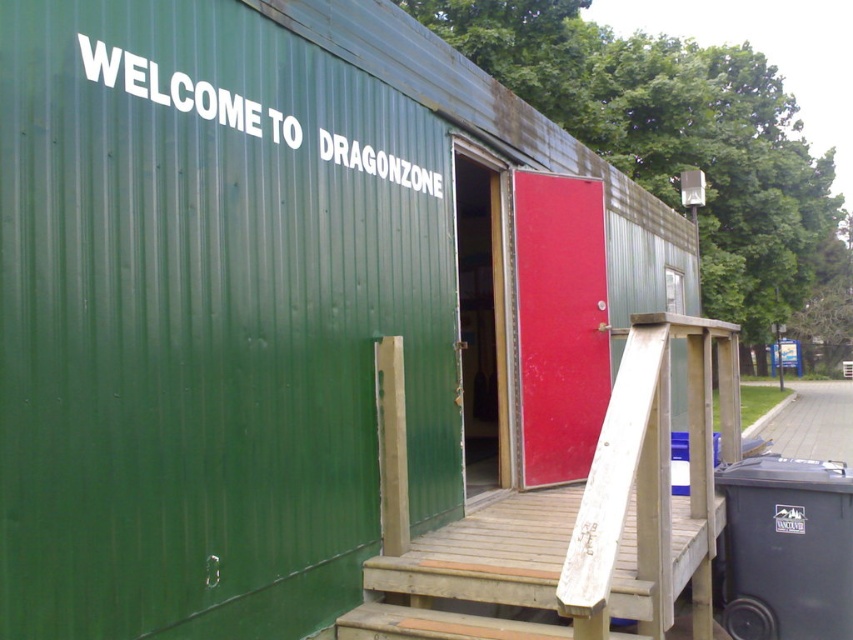
Question: Which point is closer to the camera?

Choices:
 (A) click(799, 493)
 (B) click(572, 369)

Answer: (A)

Question: Which object is positioned closest to the green wooden door at center?

Choices:
 (A) matte black trash can at lower right
 (B) red matte door at center

Answer: (B)

Question: Can you confirm if matte black trash can at lower right is positioned to the left of green wooden door at center?

Choices:
 (A) yes
 (B) no

Answer: (B)

Question: Can you confirm if red matte door at center is wider than green wooden door at center?

Choices:
 (A) yes
 (B) no

Answer: (A)

Question: Where is red matte door at center located in relation to green wooden door at center in the image?

Choices:
 (A) above
 (B) below

Answer: (B)

Question: Which object is farther from the camera taking this photo?

Choices:
 (A) matte black trash can at lower right
 (B) red matte door at center
 (C) green wooden door at center

Answer: (C)